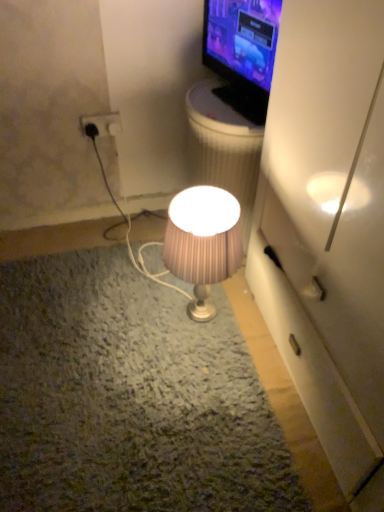
Question: Is there a large distance between white plastic trash bin/can at upper center and black plastic power outlet at upper left?

Choices:
 (A) yes
 (B) no

Answer: (B)

Question: Can black plastic power outlet at upper left be found inside white plastic trash bin/can at upper center?

Choices:
 (A) yes
 (B) no

Answer: (B)

Question: Is white plastic trash bin/can at upper center next to black plastic power outlet at upper left?

Choices:
 (A) no
 (B) yes

Answer: (A)

Question: Considering the relative sizes of white plastic trash bin/can at upper center and black plastic power outlet at upper left in the image provided, is white plastic trash bin/can at upper center thinner than black plastic power outlet at upper left?

Choices:
 (A) no
 (B) yes

Answer: (A)

Question: Is white plastic trash bin/can at upper center taller than black plastic power outlet at upper left?

Choices:
 (A) no
 (B) yes

Answer: (B)

Question: Is the depth of white plastic trash bin/can at upper center greater than that of black plastic power outlet at upper left?

Choices:
 (A) yes
 (B) no

Answer: (B)

Question: Does matte black tv at upper right have a lesser height compared to black plastic power outlet at upper left?

Choices:
 (A) yes
 (B) no

Answer: (B)

Question: Does matte black tv at upper right have a smaller size compared to black plastic power outlet at upper left?

Choices:
 (A) yes
 (B) no

Answer: (B)

Question: Can you confirm if matte black tv at upper right is positioned to the left of black plastic power outlet at upper left?

Choices:
 (A) yes
 (B) no

Answer: (B)

Question: Is matte black tv at upper right positioned in front of black plastic power outlet at upper left?

Choices:
 (A) yes
 (B) no

Answer: (A)

Question: Is matte black tv at upper right outside of black plastic power outlet at upper left?

Choices:
 (A) no
 (B) yes

Answer: (B)

Question: Is matte black tv at upper right facing towards black plastic power outlet at upper left?

Choices:
 (A) yes
 (B) no

Answer: (B)

Question: From a real-world perspective, is pink pleated fabric lampshade at center on black plastic power outlet at upper left?

Choices:
 (A) yes
 (B) no

Answer: (B)